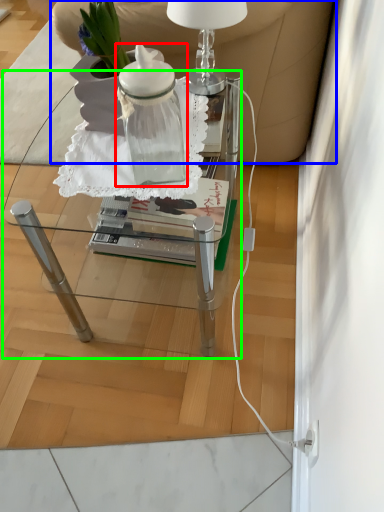
Question: Which is nearer to the bottle (highlighted by a red box)? armchair (highlighted by a blue box) or table (highlighted by a green box).

Choices:
 (A) armchair
 (B) table

Answer: (B)